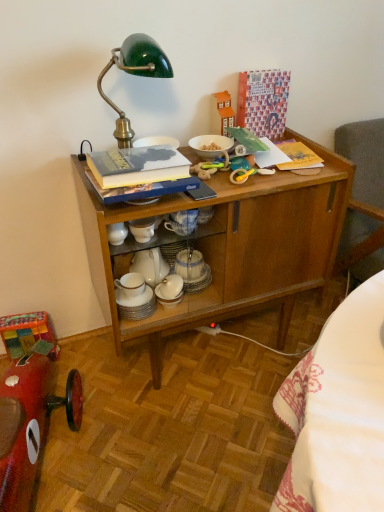
Find the location of a particular element. vacant space underneath wooden cabinet at center (from a real-world perspective) is located at coordinates (211, 349).